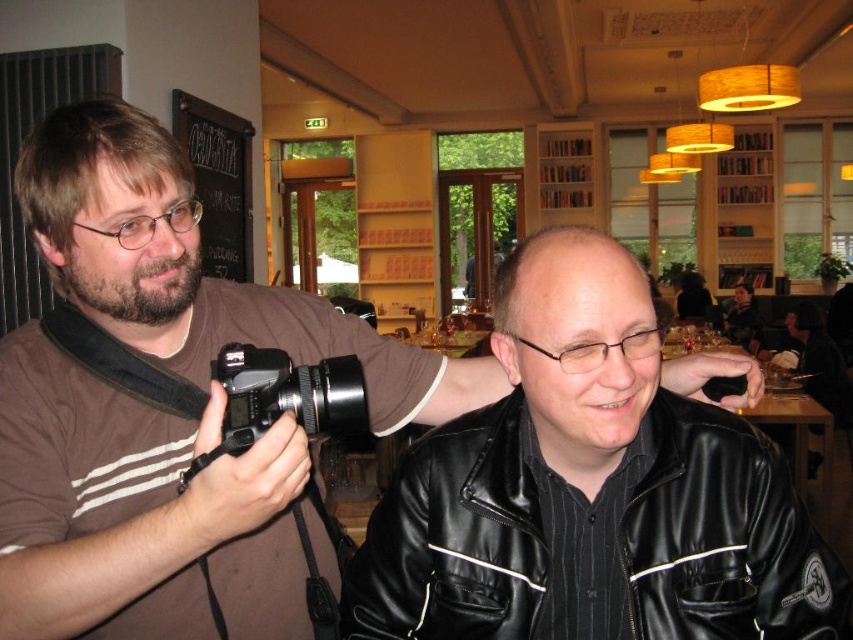
You are a photographer trying to place a black plastic camera at center between two objects. The black leather jacket at lower right is nearby. Considering their widths, which object should you move to make space for the camera?

Since the black leather jacket at lower right is wider than the black plastic camera at center, you should move the black leather jacket at lower right to make space for the camera.

You are a photographer trying to decide whether to use the black plastic camera at center or the black leather jacket at center as a prop for a photo shoot. Which object is narrower?

The black plastic camera at center is narrower than the black leather jacket at center.

Consider the image. You are standing in the cozy cafe and want to place a small decorative item exactly between the black leather jacket at lower right and the large window in the background. Can you determine the coordinates where you should place it?

The black leather jacket at lower right is located at point (724, 536). To place an item exactly between it and the large window in the background, you would need to calculate the midpoint between these two points. However, the coordinates for the window are not provided in the scene description, so the exact placement cannot be determined with the given information.